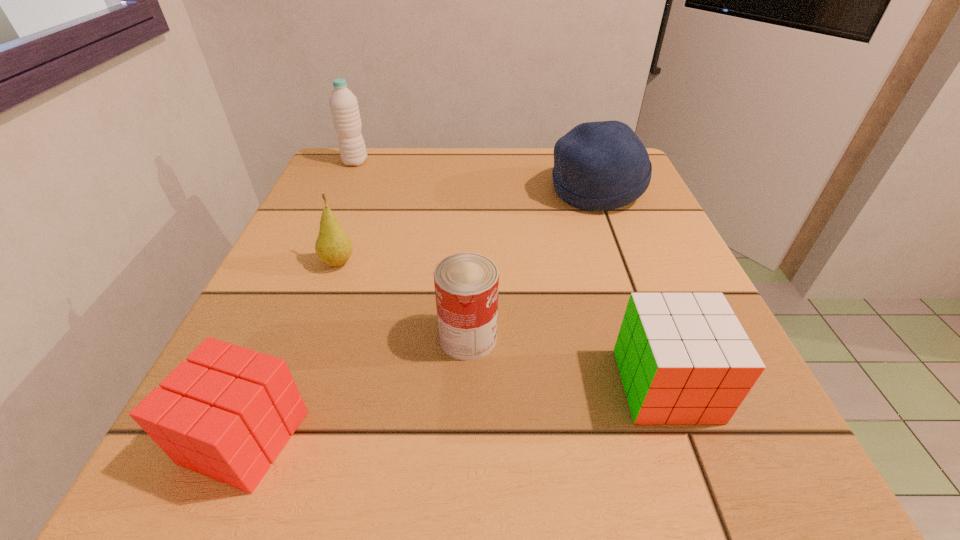
The image size is (960, 540). In the image, there is a desktop. What are the coordinates of `free space at the near right corner` in the screenshot? It's located at (734, 495).

Locate an element on the screen. This screenshot has height=540, width=960. free space between the fourth nearest object and the fifth nearest object is located at coordinates (468, 227).

Find the location of a particular element. This screenshot has width=960, height=540. free area in between the pear and the can is located at coordinates (403, 301).

Where is `free space between the farthest object and the left cube`? free space between the farthest object and the left cube is located at coordinates (300, 300).

Find the location of a particular element. Image resolution: width=960 pixels, height=540 pixels. free spot between the right cube and the pear is located at coordinates [502, 324].

Where is `blank region between the third object from right to left and the third farthest object`? blank region between the third object from right to left and the third farthest object is located at coordinates (403, 301).

Identify the location of blank region between the pear and the left cube. The height and width of the screenshot is (540, 960). (292, 350).

This screenshot has height=540, width=960. In order to click on empty location between the fourth object from left to right and the skullcap in this screenshot , I will do `click(532, 264)`.

Image resolution: width=960 pixels, height=540 pixels. I want to click on free point between the right cube and the pear, so click(502, 324).

Find the location of a particular element. The image size is (960, 540). free spot between the left cube and the skullcap is located at coordinates (420, 314).